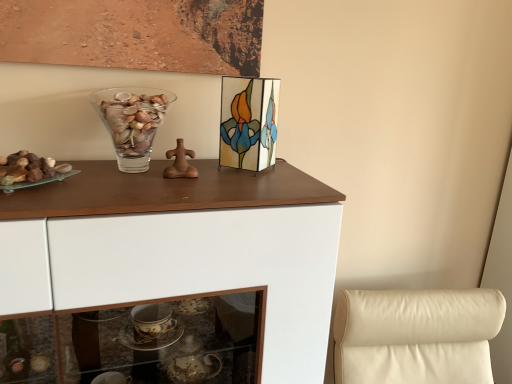
Question: Is transparent glass vase at upper center wider or thinner than stained glass picture frame at upper center?

Choices:
 (A) wide
 (B) thin

Answer: (B)

Question: From the image's perspective, is transparent glass vase at upper center above or below stained glass picture frame at upper center?

Choices:
 (A) above
 (B) below

Answer: (B)

Question: Which of these objects is positioned farthest from the white glossy cabinet at upper center?

Choices:
 (A) transparent glass vase at upper center
 (B) stained glass picture frame at upper center
 (C) translucent glass rocks at left

Answer: (C)

Question: Which is farther from the stained glass picture frame at upper center?

Choices:
 (A) white glossy cabinet at upper center
 (B) translucent glass rocks at left
 (C) transparent glass vase at upper center

Answer: (B)